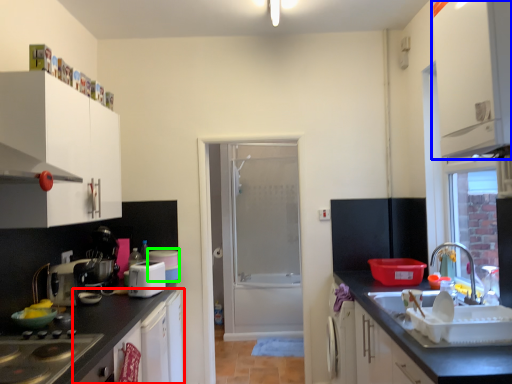
Question: Which object is positioned farthest from cabinetry (highlighted by a red box)? Select from cabinetry (highlighted by a blue box) and appliance (highlighted by a green box).

Choices:
 (A) cabinetry
 (B) appliance

Answer: (A)